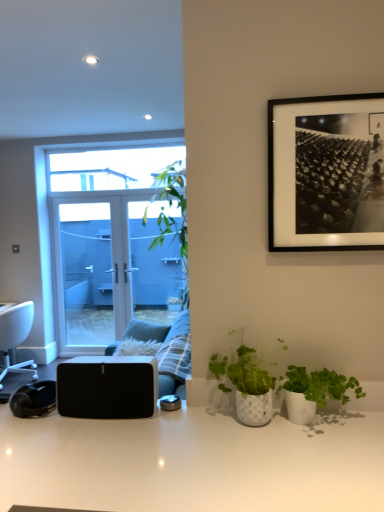
The image size is (384, 512). What do you see at coordinates (246, 383) in the screenshot? I see `green matte plant at center, the second houseplant when ordered from right to left` at bounding box center [246, 383].

Where is `black matte picture frame at upper right`? black matte picture frame at upper right is located at coordinates (326, 173).

Measure the distance between white plastic chair at left and camera.

white plastic chair at left is 4.05 meters away from camera.

I want to click on plush fabric couch at center, so click(x=167, y=349).

Image resolution: width=384 pixels, height=512 pixels. Identify the location of white glossy desk at center. (193, 462).

Does point (287, 369) come closer to viewer compared to point (143, 301)?

Yes, it is in front of point (143, 301).

From a real-world perspective, is green matte plant at lower right, the first houseplant positioned from the right, beneath blue glass door at center?

Yes, from a real-world perspective, green matte plant at lower right, the first houseplant positioned from the right, is under blue glass door at center.

How many degrees apart are the facing directions of green matte plant at lower right, the second houseplant viewed from the left, and blue glass door at center?

0.0239 degrees.

Considering the relative sizes of green matte plant at lower right, the second houseplant viewed from the left, and blue glass door at center in the image provided, is green matte plant at lower right, the second houseplant viewed from the left, taller than blue glass door at center?

No.

Could you measure the distance between black matte picture frame at upper right and green matte plant at lower right, the second houseplant viewed from the left?

They are 24.56 inches apart.

How many degrees apart are the facing directions of black matte picture frame at upper right and green matte plant at lower right, the first houseplant positioned from the right?

The facing directions of black matte picture frame at upper right and green matte plant at lower right, the first houseplant positioned from the right, are 1.57 degrees apart.

Which is more to the left, black matte picture frame at upper right or green matte plant at lower right, the second houseplant viewed from the left?

From the viewer's perspective, green matte plant at lower right, the second houseplant viewed from the left, appears more on the left side.

From the image's perspective, which is above, black matte picture frame at upper right or green matte plant at lower right, the first houseplant positioned from the right?

black matte picture frame at upper right.

What are the coordinates of `speaker in front of the plush fabric couch at center` in the screenshot? It's located at (107, 387).

From the image's perspective, which object appears higher, black matte speaker at lower left or plush fabric couch at center?

black matte speaker at lower left, from the image's perspective.

Would you say black matte speaker at lower left is to the left or to the right of plush fabric couch at center in the picture?

black matte speaker at lower left is to the right of plush fabric couch at center.

Is black matte speaker at lower left directly adjacent to plush fabric couch at center?

black matte speaker at lower left is not next to plush fabric couch at center, and they're not touching.

Is blue glass door at center not close to white plastic chair at left?

Absolutely, blue glass door at center is distant from white plastic chair at left.

Is blue glass door at center looking in the opposite direction of white plastic chair at left?

No, blue glass door at center is not facing the opposite direction of white plastic chair at left.

Between blue glass door at center and white plastic chair at left, which one has smaller width?

blue glass door at center is thinner.

How different are the orientations of blue glass door at center and white plastic chair at left in degrees?

90.5 degrees.

Which is more to the right, white glossy desk at center or blue glass door at center?

white glossy desk at center is more to the right.

Do you think white glossy desk at center is within blue glass door at center, or outside of it?

white glossy desk at center is not enclosed by blue glass door at center.

Does white glossy desk at center have a lesser width compared to blue glass door at center?

In fact, white glossy desk at center might be wider than blue glass door at center.

Find the location of a particular element. desk in front of the blue glass door at center is located at coordinates (193, 462).

Consider the image. Can you confirm if blue glass door at center is shorter than green matte plant at center, the first houseplant from the left?

In fact, blue glass door at center may be taller than green matte plant at center, the first houseplant from the left.

From a real-world perspective, is blue glass door at center physically located above or below green matte plant at center, the second houseplant when ordered from right to left?

In terms of real-world spatial position, blue glass door at center is below green matte plant at center, the second houseplant when ordered from right to left.

Is blue glass door at center to the left of green matte plant at center, the second houseplant when ordered from right to left, from the viewer's perspective?

Yes, blue glass door at center is to the left of green matte plant at center, the second houseplant when ordered from right to left.

Are blue glass door at center and green matte plant at center, the second houseplant when ordered from right to left, making contact?

No, blue glass door at center is not beside green matte plant at center, the second houseplant when ordered from right to left.

Is blue glass door at center facing away from white glossy desk at center?

blue glass door at center does not have its back to white glossy desk at center.

Looking at the image, does blue glass door at center seem bigger or smaller compared to white glossy desk at center?

Considering their sizes, blue glass door at center takes up less space than white glossy desk at center.

From the image's perspective, is blue glass door at center positioned above or below white glossy desk at center?

Answer: blue glass door at center is situated higher than white glossy desk at center in the image.

Is blue glass door at center inside the boundaries of white glossy desk at center, or outside?

blue glass door at center is not inside white glossy desk at center, it's outside.

There is a green matte plant at lower right, the second houseplant viewed from the left. At what (x,y) coordinates should I click in order to perform the action: click on window above it (from a real-world perspective). Please return your answer as a coordinate pair (x, y). This screenshot has height=512, width=384. Looking at the image, I should click on [106, 243].

This screenshot has width=384, height=512. In order to click on picture frame on the right side of green matte plant at lower right, the second houseplant viewed from the left in this screenshot , I will do `click(326, 173)`.

Which object lies further to the anchor point green matte plant at center, the second houseplant when ordered from right to left, white plastic chair at left or plush fabric couch at center?

The object further to green matte plant at center, the second houseplant when ordered from right to left, is white plastic chair at left.

Based on their spatial positions, is green matte plant at lower right, the first houseplant positioned from the right, or green matte plant at center, the second houseplant when ordered from right to left, closer to white glossy desk at center?

green matte plant at center, the second houseplant when ordered from right to left, is closer to white glossy desk at center.

Considering their positions, is white plastic chair at left positioned further to black matte speaker at lower left than blue glass door at center?

Based on the image, blue glass door at center appears to be further to black matte speaker at lower left.

Which object lies nearer to the anchor point blue glass door at center, plush fabric couch at center or green matte plant at center, the second houseplant when ordered from right to left?

plush fabric couch at center is positioned closer to the anchor blue glass door at center.

In the scene shown: From the image, which object appears to be farther from white plastic chair at left, plush fabric couch at center or green matte plant at center, the second houseplant when ordered from right to left?

green matte plant at center, the second houseplant when ordered from right to left, is positioned further to the anchor white plastic chair at left.

Consider the image. Estimate the real-world distances between objects in this image. Which object is closer to green matte plant at center, the first houseplant from the left, white glossy desk at center or white plastic chair at left?

white glossy desk at center is closer to green matte plant at center, the first houseplant from the left.

Considering their positions, is plush fabric couch at center positioned closer to white glossy desk at center than white plastic chair at left?

plush fabric couch at center is closer to white glossy desk at center.

When comparing their distances from green matte plant at lower right, the first houseplant positioned from the right, does plush fabric couch at center or blue glass door at center seem further?

blue glass door at center lies further to green matte plant at lower right, the first houseplant positioned from the right, than the other object.

Locate an element on the screen. The height and width of the screenshot is (512, 384). chair between white glossy desk at center and blue glass door at center along the z-axis is located at coordinates coord(16,337).

Locate an element on the screen. The height and width of the screenshot is (512, 384). houseplant between white glossy desk at center and green matte plant at center, the second houseplant when ordered from right to left, along the z-axis is located at coordinates (314, 391).

Locate an element on the screen. picture frame between green matte plant at center, the first houseplant from the left, and white plastic chair at left in the front-back direction is located at coordinates (326, 173).

Find the location of a particular element. This screenshot has height=512, width=384. houseplant between green matte plant at lower right, the first houseplant positioned from the right, and white plastic chair at left from front to back is located at coordinates (246, 383).